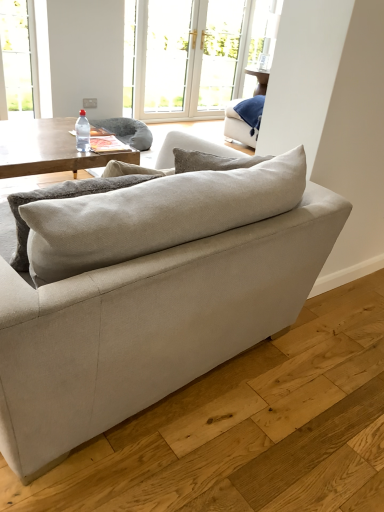
Question: Can you confirm if clear glass screen door at upper center is bigger than white glossy window at upper center?

Choices:
 (A) yes
 (B) no

Answer: (A)

Question: Is clear glass screen door at upper center at the right side of white glossy window at upper center?

Choices:
 (A) no
 (B) yes

Answer: (B)

Question: Are clear glass screen door at upper center and white glossy window at upper center far apart?

Choices:
 (A) yes
 (B) no

Answer: (B)

Question: Is clear glass screen door at upper center further to the viewer compared to white glossy window at upper center?

Choices:
 (A) yes
 (B) no

Answer: (A)

Question: Considering the relative sizes of clear glass screen door at upper center and white glossy window at upper center in the image provided, is clear glass screen door at upper center smaller than white glossy window at upper center?

Choices:
 (A) yes
 (B) no

Answer: (B)

Question: From a real-world perspective, is clear glass screen door at upper center beneath white glossy window at upper center?

Choices:
 (A) yes
 (B) no

Answer: (B)

Question: Considering the relative positions of woodenwoodencoffee table at left and white glossy window at upper center in the image provided, is woodenwoodencoffee table at left to the right of white glossy window at upper center from the viewer's perspective?

Choices:
 (A) yes
 (B) no

Answer: (B)

Question: Considering the relative sizes of woodenwoodencoffee table at left and white glossy window at upper center in the image provided, is woodenwoodencoffee table at left taller than white glossy window at upper center?

Choices:
 (A) yes
 (B) no

Answer: (B)

Question: Are woodenwoodencoffee table at left and white glossy window at upper center beside each other?

Choices:
 (A) no
 (B) yes

Answer: (A)

Question: Is woodenwoodencoffee table at left positioned before white glossy window at upper center?

Choices:
 (A) no
 (B) yes

Answer: (B)

Question: From a real-world perspective, is woodenwoodencoffee table at left below white glossy window at upper center?

Choices:
 (A) no
 (B) yes

Answer: (B)

Question: Considering the relative sizes of woodenwoodencoffee table at left and white glossy window at upper center in the image provided, is woodenwoodencoffee table at left shorter than white glossy window at upper center?

Choices:
 (A) no
 (B) yes

Answer: (B)

Question: Considering the relative positions of white glossy window at upper center and white glass door at upper center in the image provided, is white glossy window at upper center to the right of white glass door at upper center from the viewer's perspective?

Choices:
 (A) no
 (B) yes

Answer: (A)